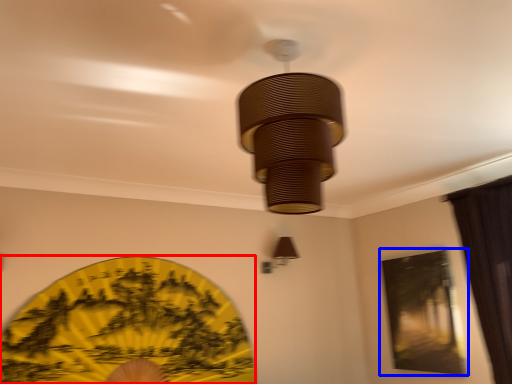
Question: Which of the following is the closest to the observer, design (highlighted by a red box) or window screen (highlighted by a blue box)?

Choices:
 (A) design
 (B) window screen

Answer: (A)